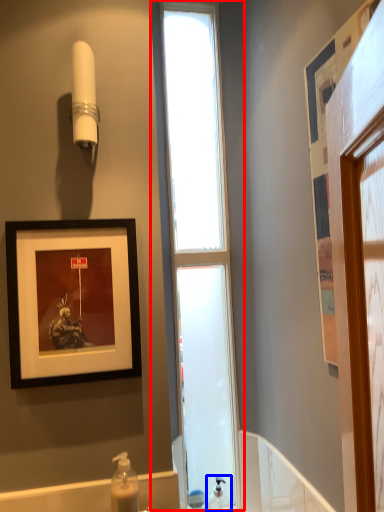
Question: Which point is further to the camera, window (highlighted by a red box) or soap dispenser (highlighted by a blue box)?

Choices:
 (A) window
 (B) soap dispenser

Answer: (A)